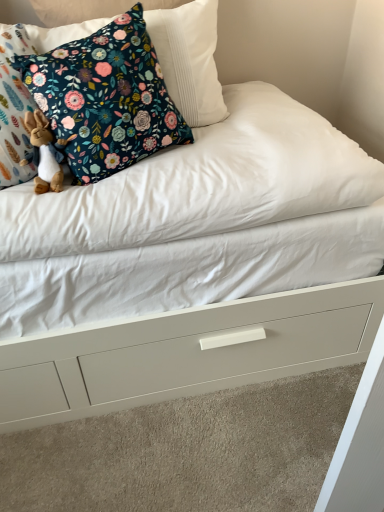
Question: Is white matte drawer at center shorter than floral fabric pillow at upper left?

Choices:
 (A) yes
 (B) no

Answer: (A)

Question: Does white matte drawer at center appear on the right side of floral fabric pillow at upper left?

Choices:
 (A) yes
 (B) no

Answer: (A)

Question: Is white matte drawer at center looking in the opposite direction of floral fabric pillow at upper left?

Choices:
 (A) no
 (B) yes

Answer: (A)

Question: From the image's perspective, is white matte drawer at center above floral fabric pillow at upper left?

Choices:
 (A) no
 (B) yes

Answer: (A)

Question: From the image's perspective, does white matte drawer at center appear lower than floral fabric pillow at upper left?

Choices:
 (A) yes
 (B) no

Answer: (A)

Question: Can you confirm if white matte drawer at center is bigger than floral fabric pillow at upper left?

Choices:
 (A) yes
 (B) no

Answer: (A)

Question: Considering the relative sizes of floral fabric pillow at upper left and brown plush rabbit at left in the image provided, is floral fabric pillow at upper left shorter than brown plush rabbit at left?

Choices:
 (A) yes
 (B) no

Answer: (B)

Question: From a real-world perspective, is floral fabric pillow at upper left beneath brown plush rabbit at left?

Choices:
 (A) yes
 (B) no

Answer: (B)

Question: Considering the relative sizes of floral fabric pillow at upper left and brown plush rabbit at left in the image provided, is floral fabric pillow at upper left thinner than brown plush rabbit at left?

Choices:
 (A) no
 (B) yes

Answer: (A)

Question: Is floral fabric pillow at upper left placed right next to brown plush rabbit at left?

Choices:
 (A) no
 (B) yes

Answer: (A)

Question: Is floral fabric pillow at upper left aimed at brown plush rabbit at left?

Choices:
 (A) yes
 (B) no

Answer: (A)

Question: Is floral fabric pillow at upper left at the left side of brown plush rabbit at left?

Choices:
 (A) no
 (B) yes

Answer: (A)

Question: Is brown plush rabbit at left to the left of floral fabric pillow at upper left from the viewer's perspective?

Choices:
 (A) no
 (B) yes

Answer: (B)